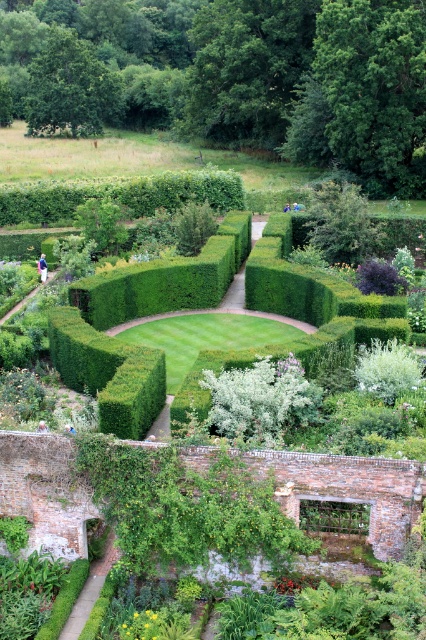
Question: Which is nearer to the light brown wooden bench at lower center?

Choices:
 (A) blue denim jeans at center
 (B) green leafy hedge at upper left

Answer: (B)

Question: Considering the relative positions of light blue shirt at center and light brown wooden bench at lower center in the image provided, where is light blue shirt at center located with respect to light brown wooden bench at lower center?

Choices:
 (A) below
 (B) above

Answer: (B)

Question: Does white fluffy bush at center have a smaller size compared to green leafy bush at center?

Choices:
 (A) yes
 (B) no

Answer: (A)

Question: Which object is closer to the camera taking this photo?

Choices:
 (A) blue denim jeans at center
 (B) light brown wooden bench at lower center
 (C) light blue shirt at center

Answer: (B)

Question: Which object appears closest to the camera in this image?

Choices:
 (A) green leafy bush at center
 (B) light brown wooden bench at lower center

Answer: (B)

Question: Does green leafy hedge at upper left appear on the right side of white fluffy bush at center?

Choices:
 (A) yes
 (B) no

Answer: (B)